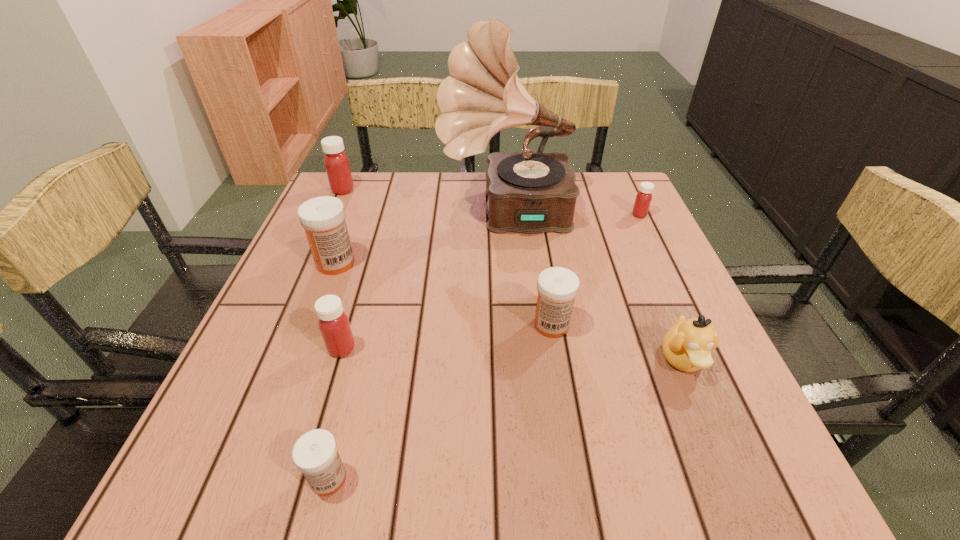
The image size is (960, 540). I want to click on white medicine that is the third closest to the tan duckling, so click(323, 218).

In order to click on the third closest white medicine to the duckling in this screenshot , I will do `click(323, 218)`.

Identify the location of free location that satisfies the following two spatial constraints: 1. on the back side of the leftmost white medicine; 2. on the right side of the second farthest red medicine. (353, 215).

You are a GUI agent. You are given a task and a screenshot of the screen. Output one action in this format:
    pyautogui.click(x=<x>, y=<y>)
    Task: Click on the vacant point that satisfies the following two spatial constraints: 1. on the front side of the second white medicine from right to left; 2. on the right side of the farthest red medicine
    
    Given the screenshot: What is the action you would take?
    pyautogui.click(x=216, y=478)